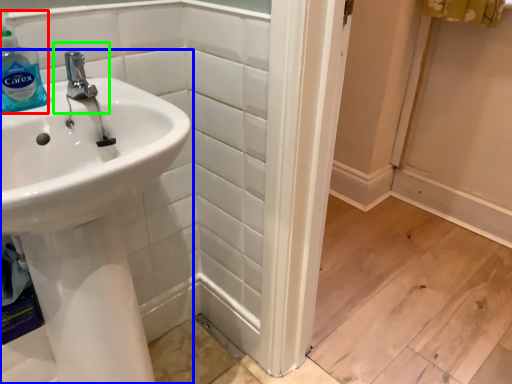
Question: Which object is the farthest from cleaning product (highlighted by a red box)? Choose among these: sink (highlighted by a blue box) or plumbing fixture (highlighted by a green box).

Choices:
 (A) sink
 (B) plumbing fixture

Answer: (A)